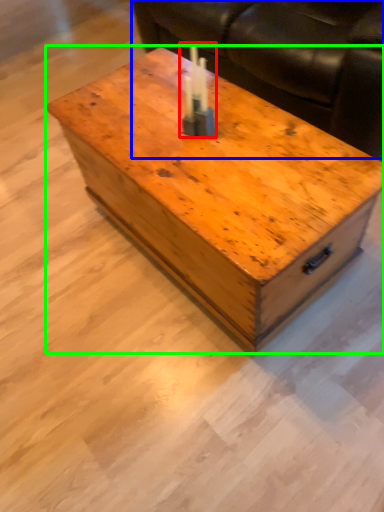
Question: Which object is positioned farthest from birthday candle (highlighted by a red box)? Select from couch (highlighted by a blue box) and coffee table (highlighted by a green box).

Choices:
 (A) couch
 (B) coffee table

Answer: (A)